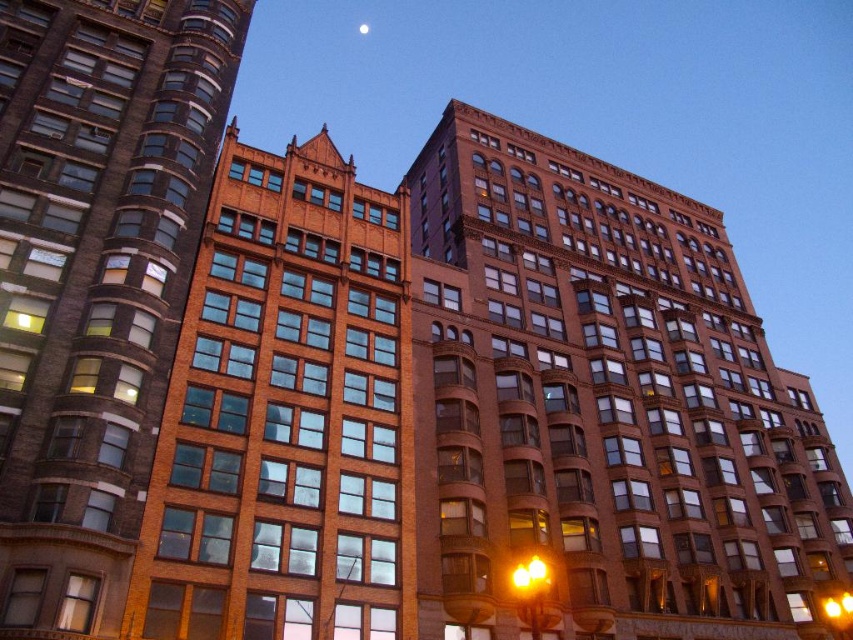
Is brick building at center positioned before bright silver moon at upper center?

Yes, brick building at center is closer to the viewer.

Which is behind, point (271, 509) or point (368, 32)?

Positioned behind is point (368, 32).

You are a GUI agent. You are given a task and a screenshot of the screen. Output one action in this format:
    pyautogui.click(x=<x>, y=<y>)
    Task: Click on the brick building at center
    
    Given the screenshot: What is the action you would take?
    coord(285,416)

Who is taller, brown brick building at center or yellow glass traffic light at center?

brown brick building at center is taller.

You are a GUI agent. You are given a task and a screenshot of the screen. Output one action in this format:
    pyautogui.click(x=<x>, y=<y>)
    Task: Click on the brown brick building at center
    
    Given the screenshot: What is the action you would take?
    pyautogui.click(x=602, y=406)

Measure the distance between brown brick building at center and camera.

brown brick building at center and camera are 43.75 meters apart.

The height and width of the screenshot is (640, 853). Identify the location of brown brick building at center. (602, 406).

Who is positioned more to the left, brown brick building at left or yellow glass traffic light at center?

brown brick building at left is more to the left.

Is point (22, 22) more distant than point (515, 572)?

That is True.

Which is behind, point (109, 227) or point (538, 595)?

Positioned behind is point (109, 227).

Locate an element on the screen. Image resolution: width=853 pixels, height=640 pixels. brown brick building at left is located at coordinates (96, 278).